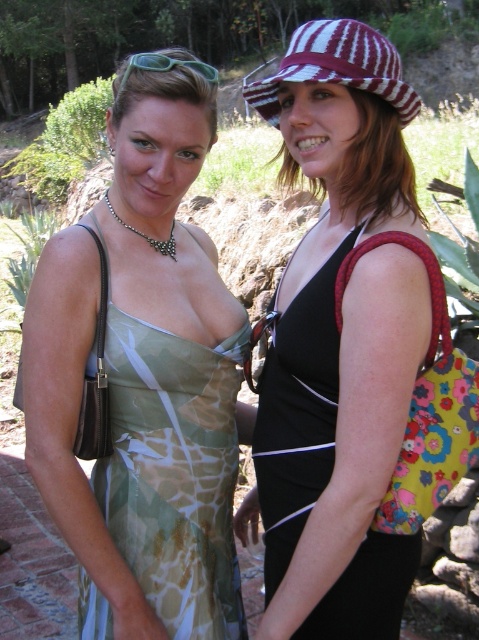
You are a photographer trying to capture both the printed fabric dress at left and the black matte dress at center in a single frame. Which dress should you focus on first to ensure both are in focus?

The printed fabric dress at left should be focused on first since the black matte dress at center is behind it, so adjusting focus starting from the front ensures both are in focus.

You are a photographer trying to capture the black matte dress at center and the maroon and white striped fabric hat at upper right in the same frame. Based on their positions, which object is higher in the image?

The maroon and white striped fabric hat at upper right is higher in the image than the black matte dress at center because the black matte dress at center is below the maroon and white striped fabric hat at upper right.

You are a fashion designer observing two women in a garden. The first woman wears a black matte dress at center, and the second has a maroon and white striped fabric hat at upper right. Which clothing item is shorter in length?

The black matte dress at center is shorter than the maroon and white striped fabric hat at upper right.